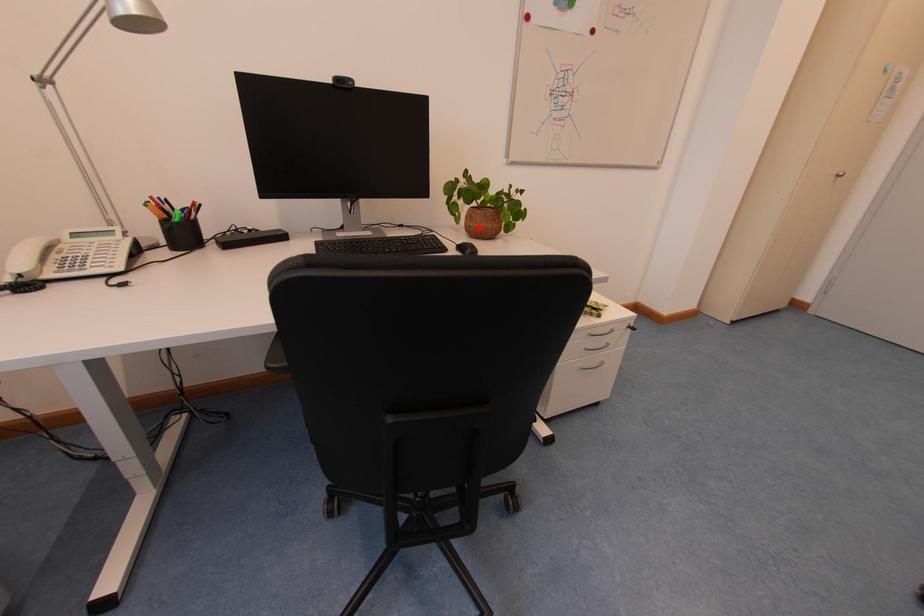
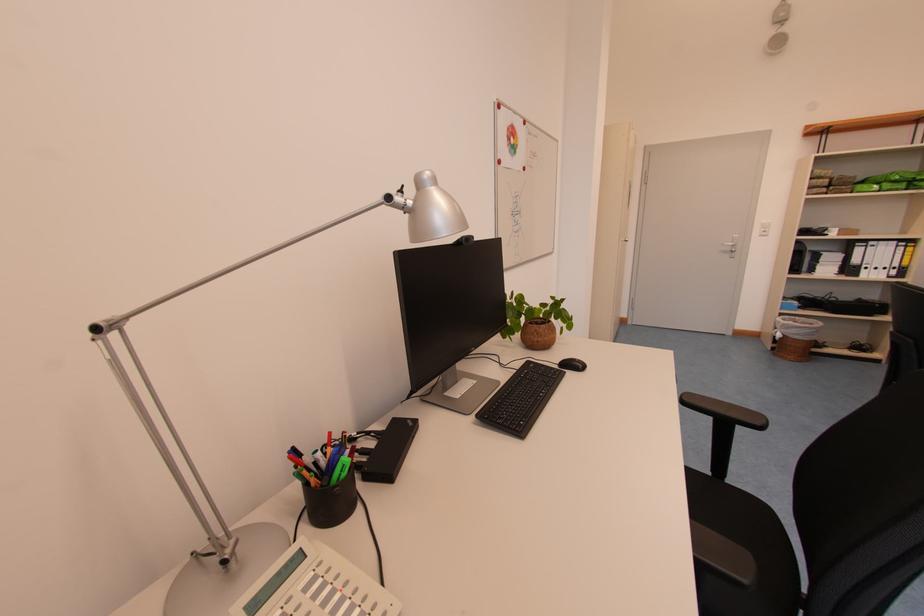
The point at the highlighted location is marked in the first image. Where is the corresponding point in the second image?

(546, 342)